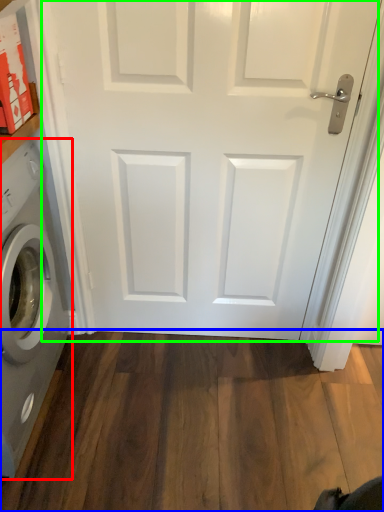
Question: Based on their relative distances, which object is nearer to washing machine (highlighted by a red box)? Choose from hardwood (highlighted by a blue box) and door (highlighted by a green box).

Choices:
 (A) hardwood
 (B) door

Answer: (B)